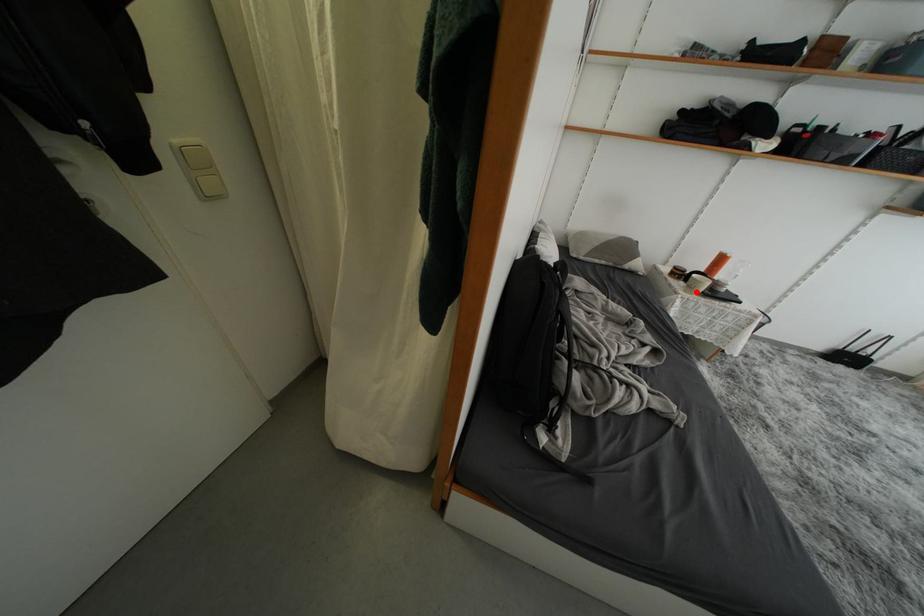
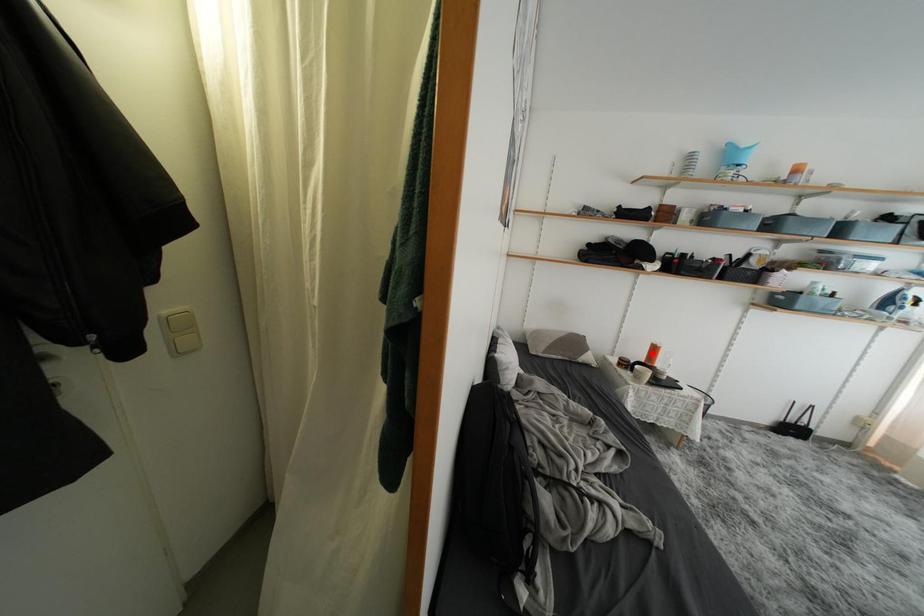
I am providing you with two images of the same scene from different viewpoints. A red point is marked on the first image and another point is marked on the second image. Do the highlighted points in image1 and image2 indicate the same real-world spot?

No